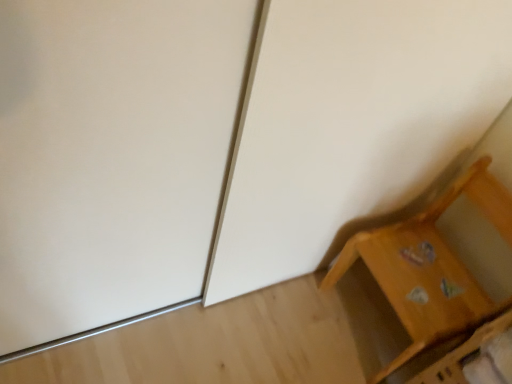
Where is `free space underneath wooden chair at lower right (from a real-world perspective)`? The image size is (512, 384). free space underneath wooden chair at lower right (from a real-world perspective) is located at coordinates (369, 317).